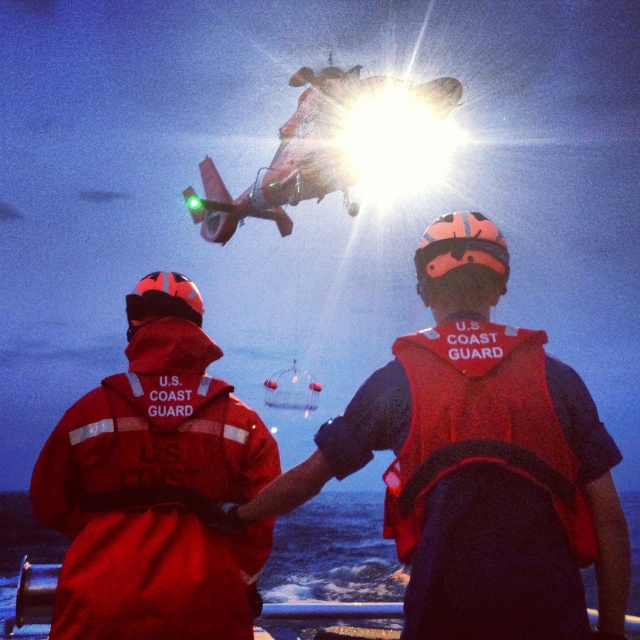
Question: Considering the relative positions of orange life vest at center and red matte uniform at left in the image provided, where is orange life vest at center located with respect to red matte uniform at left?

Choices:
 (A) right
 (B) left

Answer: (A)

Question: Which object is the farthest from the red fabric life jacket at center?

Choices:
 (A) red fabric boat at lower center
 (B) orange life vest at center

Answer: (A)

Question: Which object is closer to the camera taking this photo?

Choices:
 (A) red fabric boat at lower center
 (B) red matte uniform at left

Answer: (A)

Question: From the image, what is the correct spatial relationship of orange life vest at center in relation to red matte uniform at left?

Choices:
 (A) left
 (B) right

Answer: (B)

Question: Which object is positioned farthest from the orange life vest at center?

Choices:
 (A) red fabric life jacket at center
 (B) red fabric boat at lower center

Answer: (B)

Question: From the image, what is the correct spatial relationship of orange life vest at center in relation to red fabric boat at lower center?

Choices:
 (A) left
 (B) right

Answer: (B)